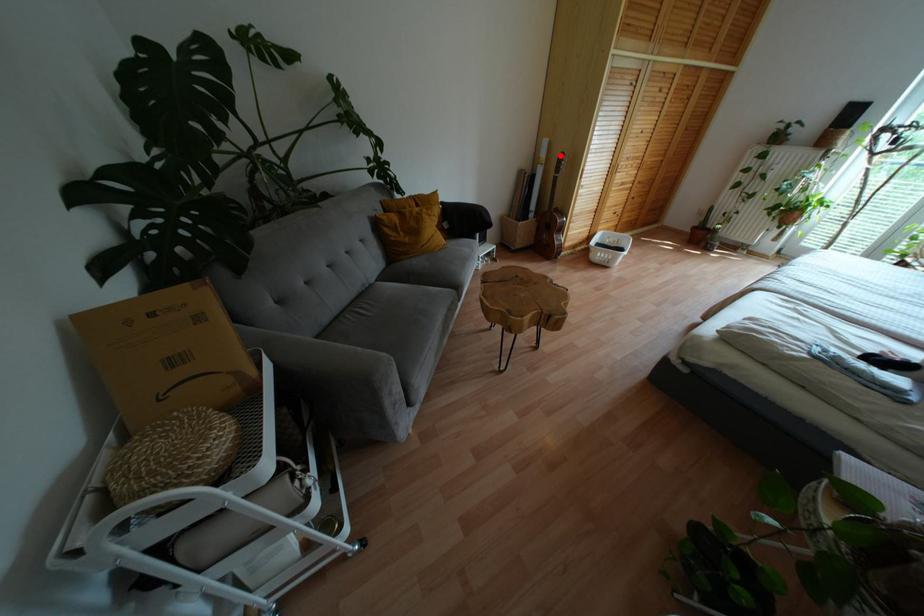
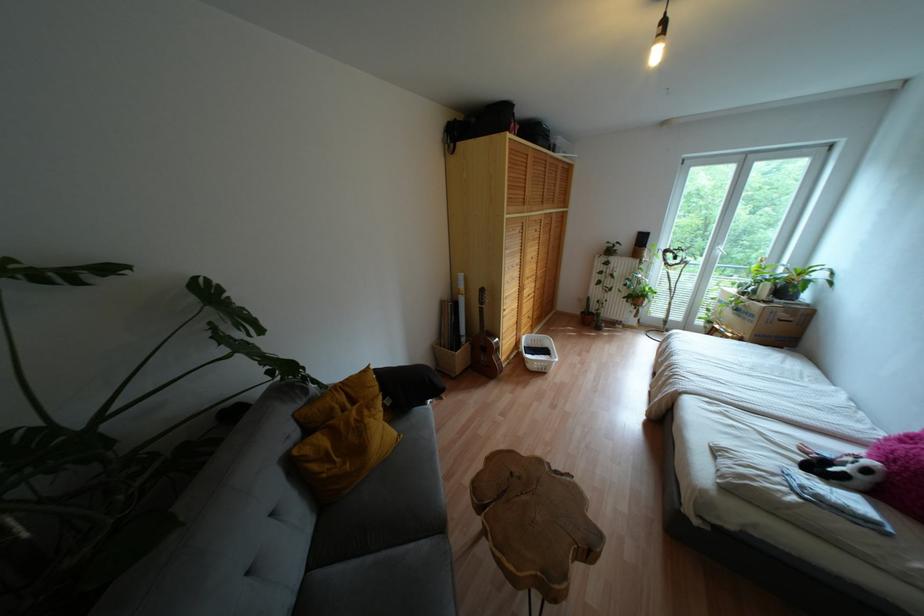
Question: I am providing you with two images of the same scene from different viewpoints. In image1, a red point is highlighted. Considering the same 3D point in image2, which of the following is correct?

Choices:
 (A) It is closer
 (B) It is farther

Answer: (B)